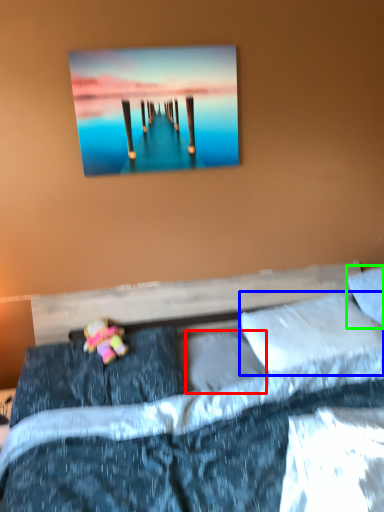
Question: Which is farther away from pillow (highlighted by a red box)? pillow (highlighted by a blue box) or pillow (highlighted by a green box)?

Choices:
 (A) pillow
 (B) pillow

Answer: (B)